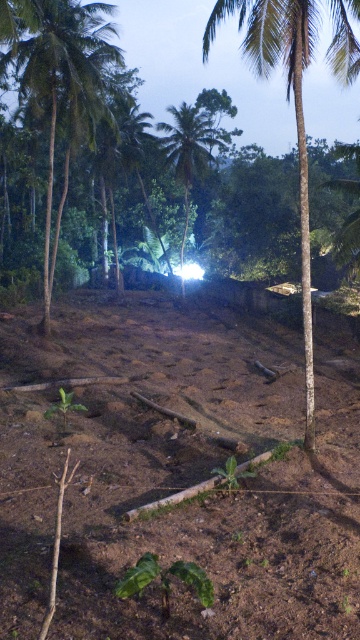
From the picture: You are a hiker who has lost your way in the dark. You see a beam of light illuminating the area. In the clearing, there is brown soil at center and a green leafy palm tree at left. Which object is closer to the light source?

The brown soil at center is closer to the light source because it is positioned to the right of the green leafy palm tree at left, and the light beam is likely illuminating the area from the direction of the soil.

You are standing in a rural clearing with a flashlight. You notice a point in the center of the clearing marked by coordinates. What is located at the coordinates point [177,472]?

At point [177,472] lies brown soil at center.

You are standing in the clearing and want to walk towards the light source. Which object, the brown soil at center or the green leafy palm tree at left, will you step on first?

The brown soil at center is closer to the viewer than the green leafy palm tree at left, so you will step on the brown soil at center first.